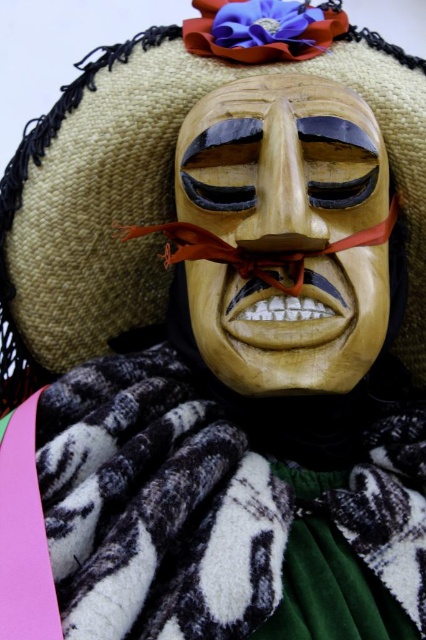
You are standing in front of the person wearing the traditional costume. You notice two points on the mask and hat. The first point is at coordinate point [342,256] and the second point is at coordinate point [236,262]. Which point is closer to you?

Point [342,256] is further to the viewer than point [236,262]. Therefore, point [236,262] is closer to you.

You are an artist trying to sketch the wooden mask at center in the image. You notice a specific point marked at coordinate point (284, 234). Based on the image, where is this point located on the wooden mask at center?

The point at coordinate (284, 234) is located on the wooden mask at center.

You are an artist trying to sketch the scene. You notice the wooden mask at center and the red silk ribbon at center. Which object should you draw first if you want to focus on the larger element?

The wooden mask at center is larger in size than the red silk ribbon at center, so you should draw the wooden mask at center first to focus on the larger element.